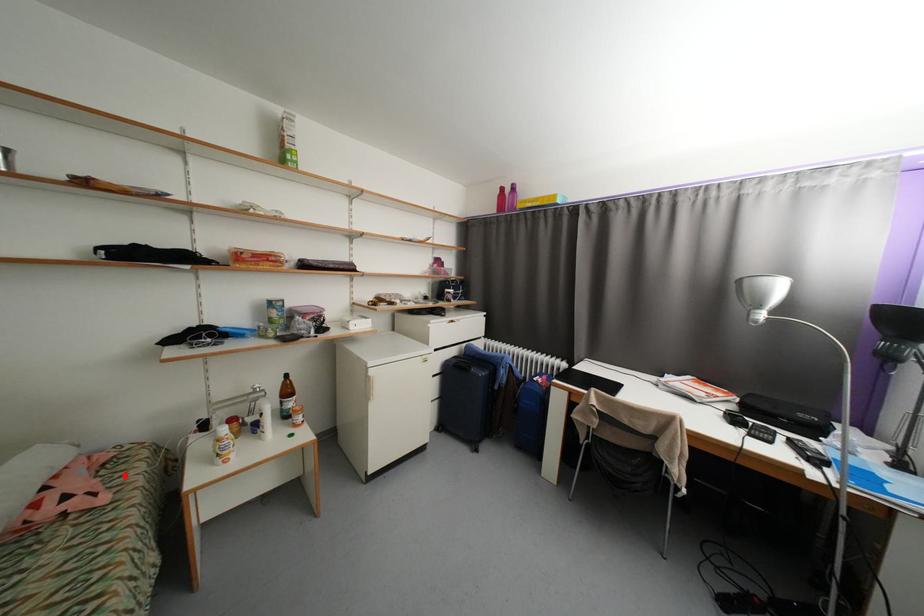
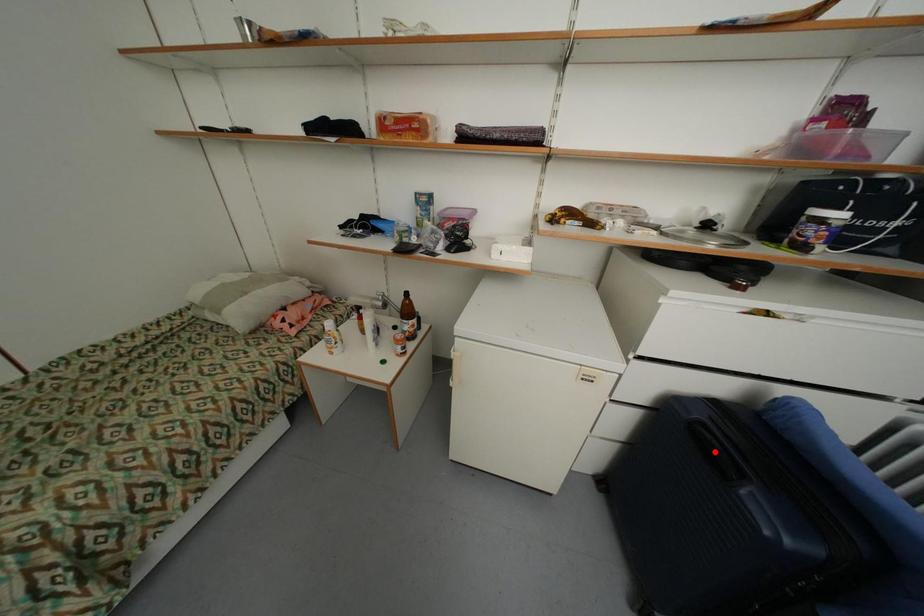
I am providing you with two images of the same scene from different viewpoints. A red point is marked on the first image and another point is marked on the second image. Are the points marked in image1 and image2 representing the same 3D position?

No